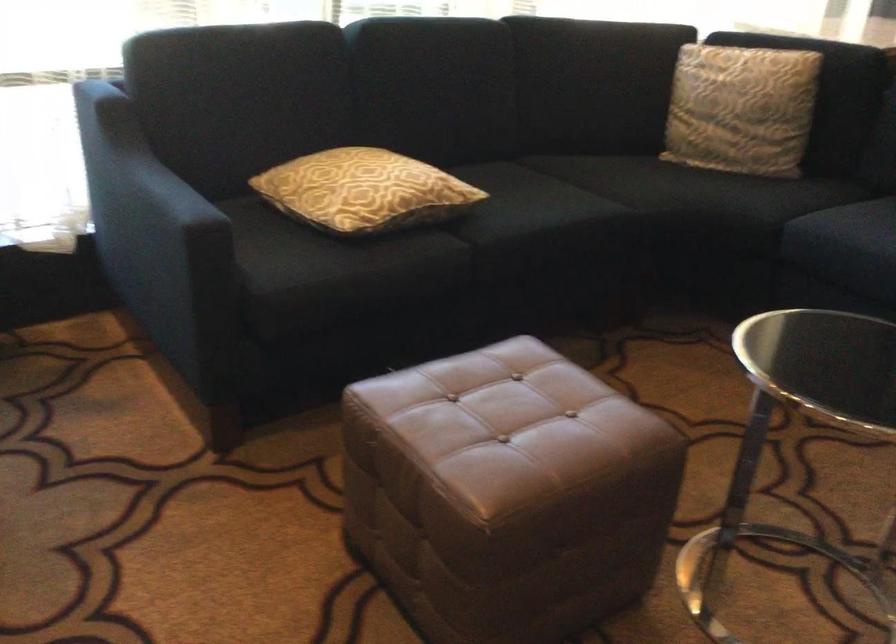
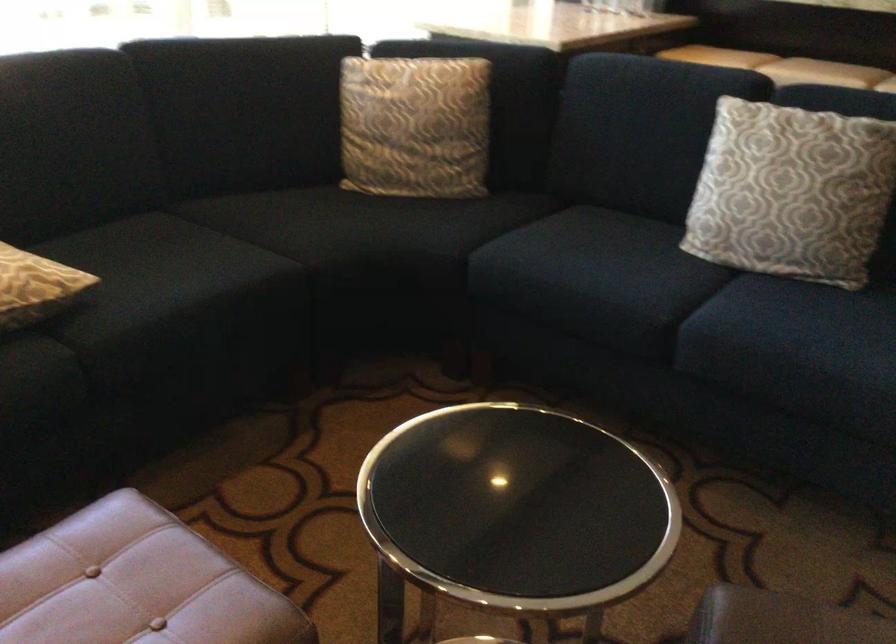
Find the pixel in the second image that matches point (520, 200) in the first image.

(161, 270)